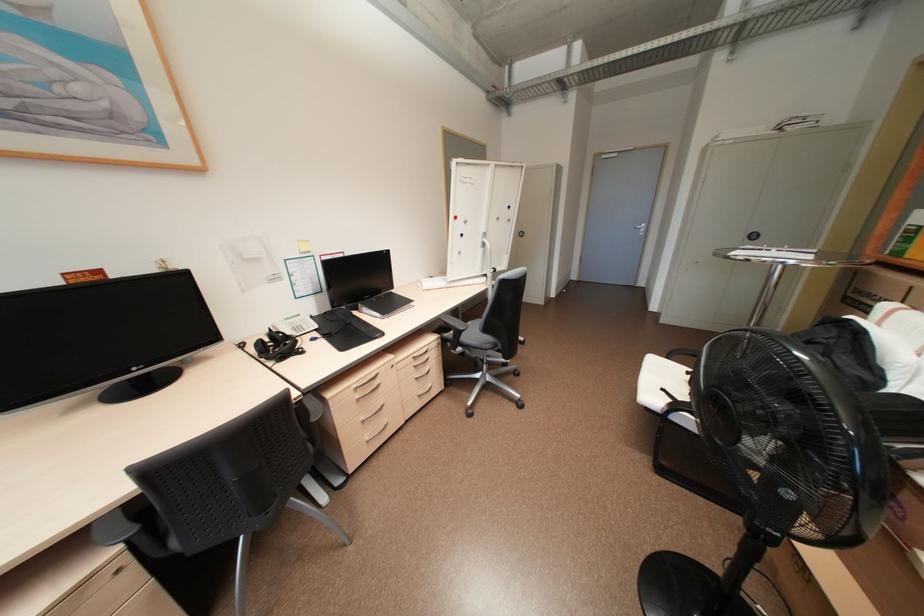
What do you see at coordinates (453, 325) in the screenshot?
I see `the chair armrest` at bounding box center [453, 325].